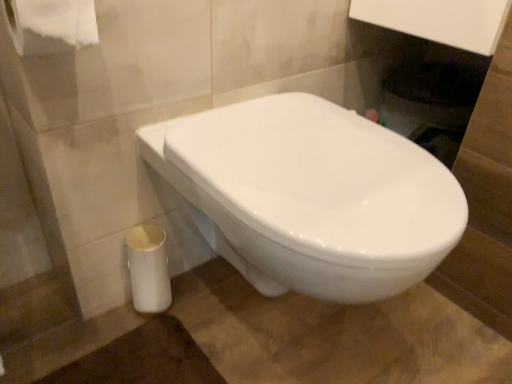
What do you see at coordinates (310, 196) in the screenshot?
I see `white glossy toilet at center` at bounding box center [310, 196].

Image resolution: width=512 pixels, height=384 pixels. In order to click on white paper at upper left in this screenshot , I will do `click(51, 25)`.

The image size is (512, 384). I want to click on white glossy toilet at center, so click(x=310, y=196).

You are a GUI agent. You are given a task and a screenshot of the screen. Output one action in this format:
    pyautogui.click(x=<x>, y=<y>)
    Task: Click on the porcelain that is below the white glossy toilet at center (from the image's perspective)
    Image resolution: width=512 pixels, height=384 pixels.
    Given the screenshot: What is the action you would take?
    pyautogui.click(x=148, y=269)

Which is correct: white glossy toilet at center is inside white glossy trash can at lower left, or outside of it?

white glossy toilet at center cannot be found inside white glossy trash can at lower left.

How many degrees apart are the facing directions of white glossy toilet at center and white glossy trash can at lower left?

The angular difference between white glossy toilet at center and white glossy trash can at lower left is 8.87 degrees.

Considering the positions of point (403, 158) and point (137, 295), is point (403, 158) closer or farther from the camera than point (137, 295)?

Clearly, point (403, 158) is closer to the camera than point (137, 295).

Considering the positions of point (139, 309) and point (376, 209), is point (139, 309) closer or farther from the camera than point (376, 209)?

Point (139, 309) is positioned farther from the camera compared to point (376, 209).

From a real-world perspective, is white glossy trash can at lower left beneath white glossy toilet at center?

Yes, from a real-world perspective, white glossy trash can at lower left is beneath white glossy toilet at center.

Is white glossy trash can at lower left positioned in front of white glossy toilet at center?

No.

Considering the relative positions of white glossy trash can at lower left and white glossy toilet at center in the image provided, is white glossy trash can at lower left to the left of white glossy toilet at center from the viewer's perspective?

Correct, you'll find white glossy trash can at lower left to the left of white glossy toilet at center.

Is white paper at upper left oriented away from white glossy toilet at center?

No, white paper at upper left's orientation is not away from white glossy toilet at center.

At what (x,y) coordinates should I click in order to perform the action: click on toilet below the white paper at upper left (from a real-world perspective). Please return your answer as a coordinate pair (x, y). Image resolution: width=512 pixels, height=384 pixels. Looking at the image, I should click on (310, 196).

Can you tell me how much white paper at upper left and white glossy toilet at center differ in facing direction?

The angular difference between white paper at upper left and white glossy toilet at center is 7.34 degrees.

Locate an element on the screen. porcelain located on the right of white paper at upper left is located at coordinates (148, 269).

From the image's perspective, which one is positioned lower, white paper at upper left or white glossy trash can at lower left?

From the image's view, white glossy trash can at lower left is below.

Is white paper at upper left in contact with white glossy trash can at lower left?

white paper at upper left and white glossy trash can at lower left are clearly separated.

Considering the sizes of objects white paper at upper left and white glossy trash can at lower left in the image provided, who is thinner, white paper at upper left or white glossy trash can at lower left?

With smaller width is white glossy trash can at lower left.

Would you consider white glossy trash can at lower left to be distant from white paper at upper left?

No, there isn't a large distance between white glossy trash can at lower left and white paper at upper left.

Considering the relative sizes of white glossy trash can at lower left and white paper at upper left in the image provided, is white glossy trash can at lower left smaller than white paper at upper left?

Yes.

How far apart are white glossy trash can at lower left and white paper at upper left?

white glossy trash can at lower left is 17.74 inches away from white paper at upper left.

You are a GUI agent. You are given a task and a screenshot of the screen. Output one action in this format:
    pyautogui.click(x=<x>, y=<y>)
    Task: Click on the toilet paper above the white glossy trash can at lower left (from a real-world perspective)
    
    Given the screenshot: What is the action you would take?
    pyautogui.click(x=51, y=25)

Considering the sizes of white glossy toilet at center and white paper at upper left in the image, is white glossy toilet at center wider or thinner than white paper at upper left?

In the image, white glossy toilet at center appears to be wider than white paper at upper left.

Is white paper at upper left at the back of white glossy toilet at center?

No, white glossy toilet at center's orientation is not away from white paper at upper left.

Is there a large distance between white glossy toilet at center and white paper at upper left?

Actually, white glossy toilet at center and white paper at upper left are a little close together.

Who is shorter, white glossy toilet at center or white paper at upper left?

With less height is white paper at upper left.

I want to click on toilet in front of the white glossy trash can at lower left, so click(x=310, y=196).

You are a GUI agent. You are given a task and a screenshot of the screen. Output one action in this format:
    pyautogui.click(x=<x>, y=<y>)
    Task: Click on the porcelain below the white glossy toilet at center (from a real-world perspective)
    
    Given the screenshot: What is the action you would take?
    pyautogui.click(x=148, y=269)

Which object lies nearer to the anchor point white paper at upper left, white glossy trash can at lower left or white glossy toilet at center?

The object closer to white paper at upper left is white glossy toilet at center.

Considering their positions, is white glossy toilet at center positioned closer to white glossy trash can at lower left than white paper at upper left?

white glossy toilet at center is positioned closer to the anchor white glossy trash can at lower left.

Looking at the image, which one is located closer to white glossy toilet at center, white paper at upper left or white glossy trash can at lower left?

The object closer to white glossy toilet at center is white glossy trash can at lower left.

Considering their positions, is white glossy trash can at lower left positioned further to white glossy toilet at center than white paper at upper left?

Among the two, white paper at upper left is located further to white glossy toilet at center.

Estimate the real-world distances between objects in this image. Which object is closer to white paper at upper left, white glossy toilet at center or white glossy trash can at lower left?

white glossy toilet at center.

Looking at the image, which one is located closer to white glossy trash can at lower left, white paper at upper left or white glossy toilet at center?

The object closer to white glossy trash can at lower left is white glossy toilet at center.

Locate an element on the screen. The height and width of the screenshot is (384, 512). toilet paper between white glossy toilet at center and white glossy trash can at lower left from front to back is located at coordinates (51, 25).